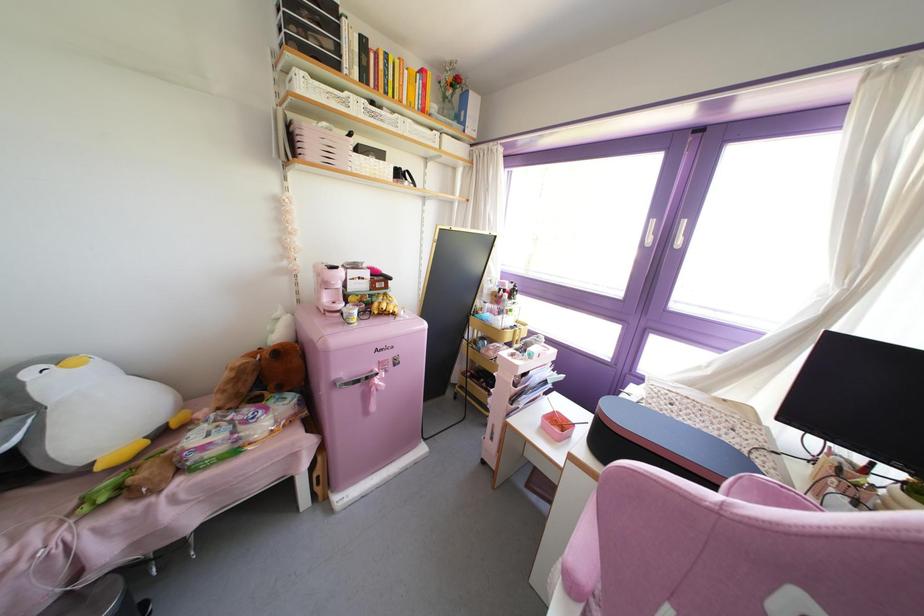
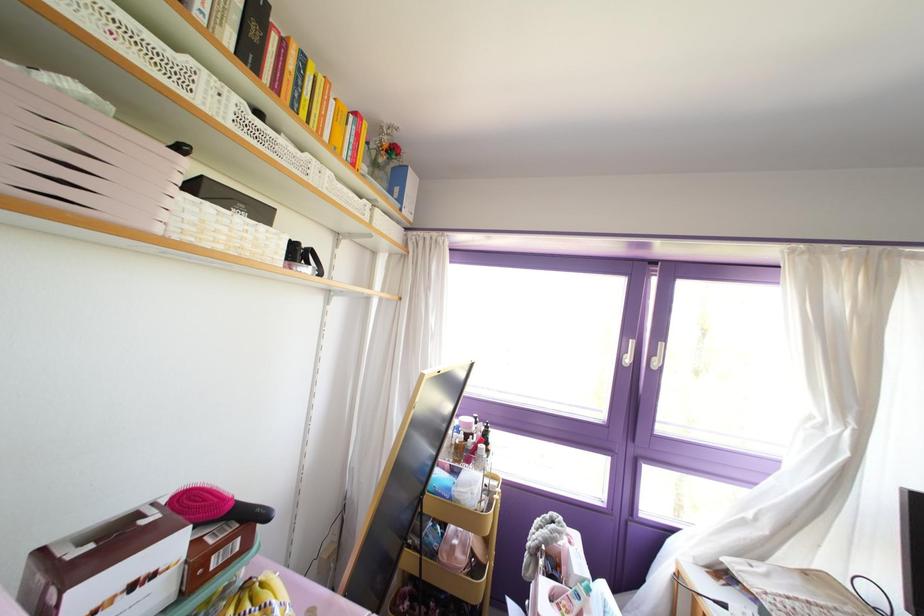
Find the pixel in the second image that matches [444,98] in the first image.

(372, 163)